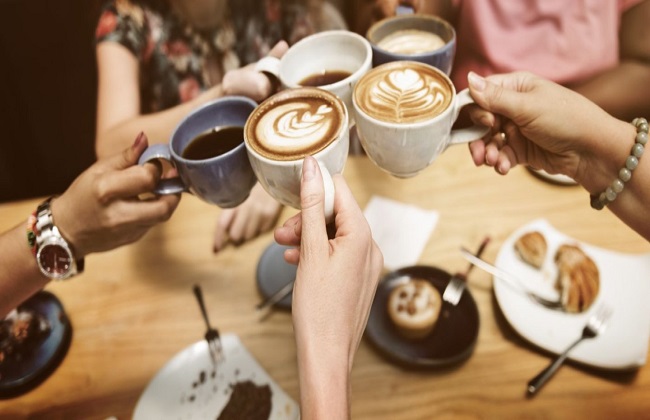
The width and height of the screenshot is (650, 420). Find the location of `fork`. fork is located at coordinates (450, 281), (559, 353), (205, 337), (270, 295).